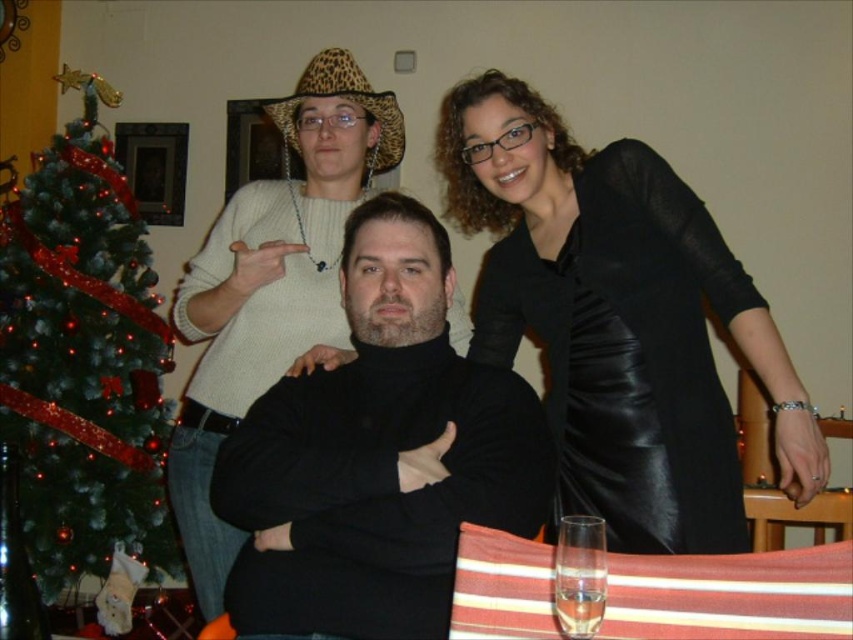
Between point (498, 289) and point (115, 301), which one is positioned in front?

Point (498, 289) is in front.

Is black leather dress at upper right closer to the viewer compared to green textured christmas tree at left?

Yes, it is.

Image resolution: width=853 pixels, height=640 pixels. What are the coordinates of `black leather dress at upper right` in the screenshot? It's located at (618, 320).

You are a GUI agent. You are given a task and a screenshot of the screen. Output one action in this format:
    pyautogui.click(x=<x>, y=<y>)
    Task: Click on the black leather dress at upper right
    This screenshot has height=640, width=853.
    Given the screenshot: What is the action you would take?
    pyautogui.click(x=618, y=320)

Based on the photo, is green textured christmas tree at left positioned before clear glass at lower right?

No, green textured christmas tree at left is behind clear glass at lower right.

Can you confirm if green textured christmas tree at left is thinner than clear glass at lower right?

No, green textured christmas tree at left is not thinner than clear glass at lower right.

This screenshot has height=640, width=853. Find the location of `green textured christmas tree at left`. green textured christmas tree at left is located at coordinates (84, 358).

Image resolution: width=853 pixels, height=640 pixels. Identify the location of green textured christmas tree at left. (84, 358).

From the picture: Is black turtleneck sweater at center thinner than green textured christmas tree at left?

Indeed, black turtleneck sweater at center has a lesser width compared to green textured christmas tree at left.

Is black turtleneck sweater at center wider than green textured christmas tree at left?

Incorrect, black turtleneck sweater at center's width does not surpass green textured christmas tree at left's.

Which is behind, point (410, 401) or point (94, 445)?

The point (94, 445) is behind.

At what (x,y) coordinates should I click in order to perform the action: click on black turtleneck sweater at center. Please return your answer as a coordinate pair (x, y). Looking at the image, I should click on (378, 456).